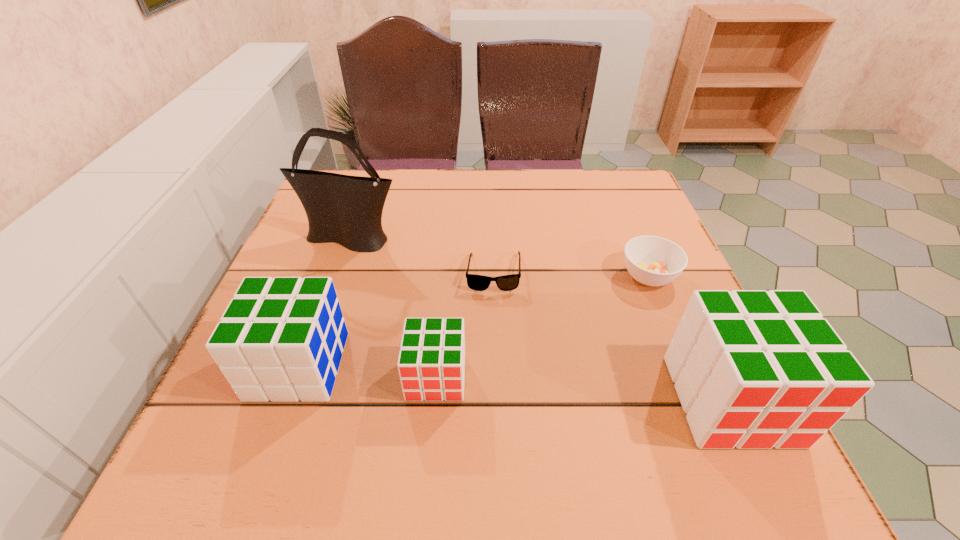
Locate an element on the screen. empty location between the soup bowl and the shortest cube is located at coordinates (542, 326).

Identify the location of unoccupied area between the leftmost cube and the second shortest object. The height and width of the screenshot is (540, 960). (473, 321).

Where is `object that stands as the closest to the fifth tallest object`? This screenshot has height=540, width=960. object that stands as the closest to the fifth tallest object is located at coordinates (753, 369).

Identify which object is the nearest to the shortest object. Please provide its 2D coordinates. Your answer should be formatted as a tuple, i.e. [(x, y)], where the tuple contains the x and y coordinates of a point satisfying the conditions above.

[(343, 209)]

Identify which cube is the second nearest to the rightmost cube. Please provide its 2D coordinates. Your answer should be formatted as a tuple, i.e. [(x, y)], where the tuple contains the x and y coordinates of a point satisfying the conditions above.

[(281, 339)]

You are a GUI agent. You are given a task and a screenshot of the screen. Output one action in this format:
    pyautogui.click(x=<x>, y=<y>)
    Task: Click on the cube that is the closest to the second shortest object
    The height and width of the screenshot is (540, 960).
    Given the screenshot: What is the action you would take?
    pyautogui.click(x=753, y=369)

Where is `vacant area that satisfies the following two spatial constraints: 1. on the front-facing side of the shortest object; 2. on the red face of the second tallest cube`? The image size is (960, 540). vacant area that satisfies the following two spatial constraints: 1. on the front-facing side of the shortest object; 2. on the red face of the second tallest cube is located at coordinates (496, 366).